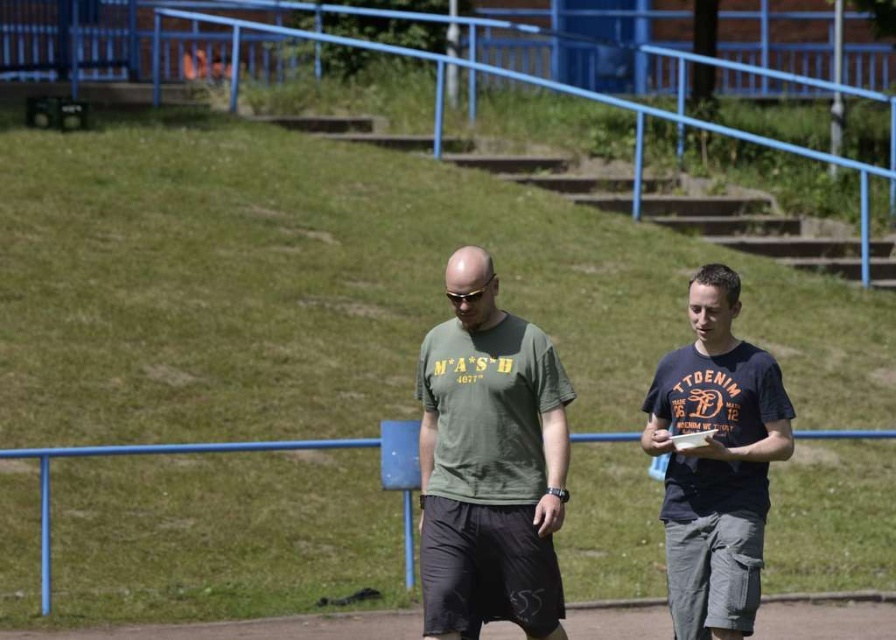
Is dark blue cotton t-shirt at right to the left of blue metal rail at center from the viewer's perspective?

Incorrect, dark blue cotton t-shirt at right is not on the left side of blue metal rail at center.

Is point (714, 600) less distant than point (44, 500)?

Yes.

Where is `dark blue cotton t-shirt at right`? dark blue cotton t-shirt at right is located at coordinates (714, 461).

Find the location of a particular element. The image size is (896, 640). dark blue cotton t-shirt at right is located at coordinates (714, 461).

Is green cotton t-shirt at center to the left of blue metal rail at center from the viewer's perspective?

No, green cotton t-shirt at center is not to the left of blue metal rail at center.

Does green cotton t-shirt at center lie behind blue metal rail at center?

That is False.

Where is `green cotton t-shirt at center`? The width and height of the screenshot is (896, 640). green cotton t-shirt at center is located at coordinates (490, 472).

Identify the location of green cotton t-shirt at center. The image size is (896, 640). (490, 472).

Can you confirm if green cotton t-shirt at center is thinner than black matte sunglasses at center?

In fact, green cotton t-shirt at center might be wider than black matte sunglasses at center.

Which is in front, point (685, 371) or point (489, 282)?

Point (489, 282) is more forward.

At what (x,y) coordinates should I click in order to perform the action: click on green cotton t-shirt at center. Please return your answer as a coordinate pair (x, y). The image size is (896, 640). Looking at the image, I should click on (490, 472).